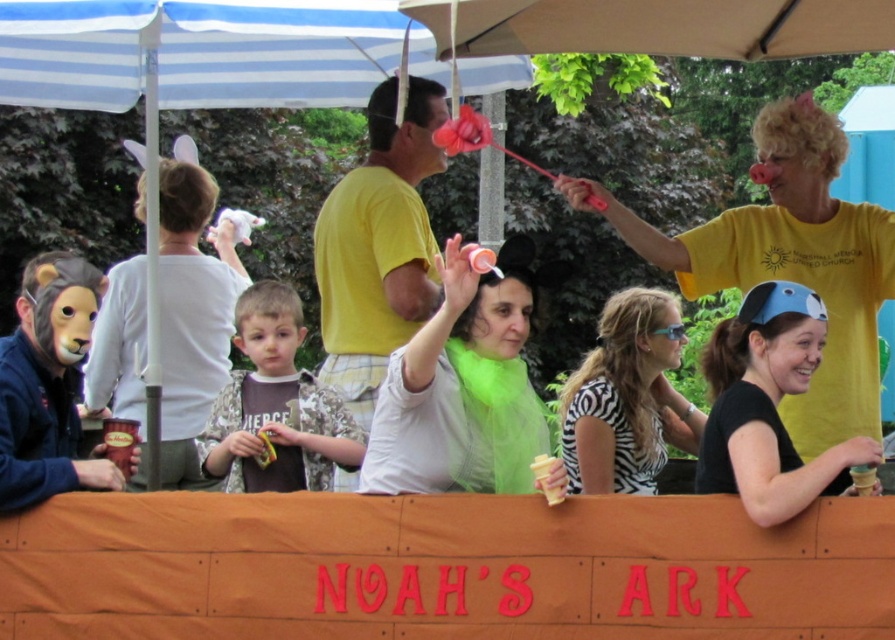
Question: Which of the following is the farthest from the observer?

Choices:
 (A) yellow matte shirt at center
 (B) camouflage jacket at center

Answer: (A)

Question: Is yellow matte shirt at center further to the viewer compared to yellow matte ice cream at center?

Choices:
 (A) yes
 (B) no

Answer: (A)

Question: From the image, what is the correct spatial relationship of yellow matte shirt at center in relation to camouflage jacket at center?

Choices:
 (A) right
 (B) left

Answer: (A)

Question: Does blue striped fabric umbrella at upper left come behind camouflage jacket at center?

Choices:
 (A) no
 (B) yes

Answer: (B)

Question: Which of the following is the closest to the observer?

Choices:
 (A) (361, 298)
 (B) (785, 257)
 (C) (396, 278)
 (D) (537, 460)

Answer: (D)

Question: Which object is the closest to the yellow t-shirt at upper right?

Choices:
 (A) yellow matte shirt at center
 (B) blue striped canopy at upper center
 (C) camouflage jacket at center

Answer: (A)